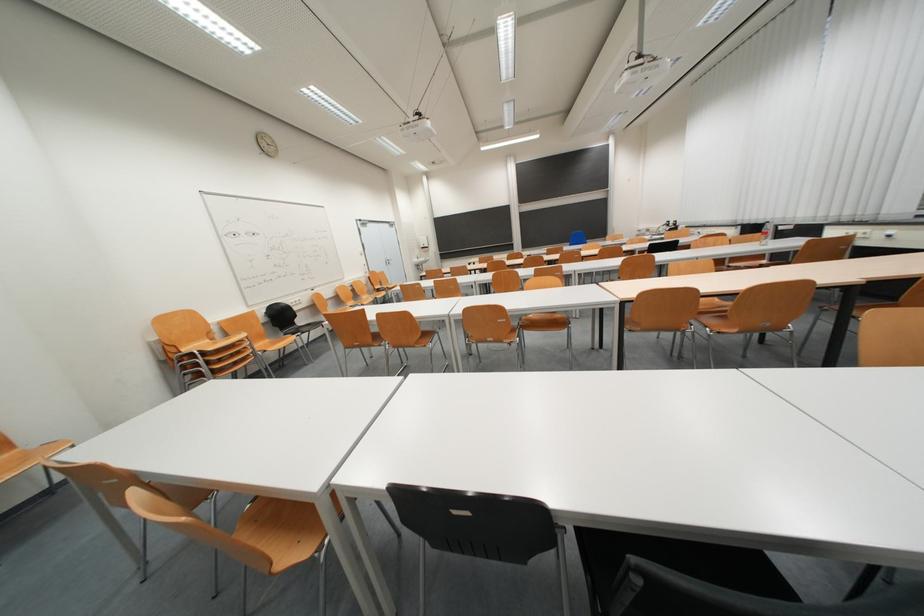
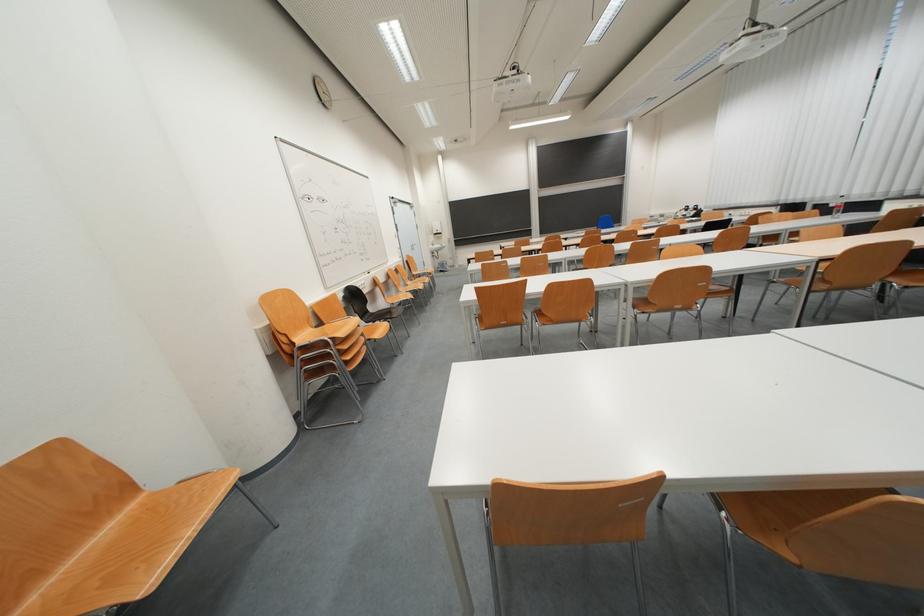
Where in the second image is the point corresponding to pixel 308 326 from the first image?

(379, 313)